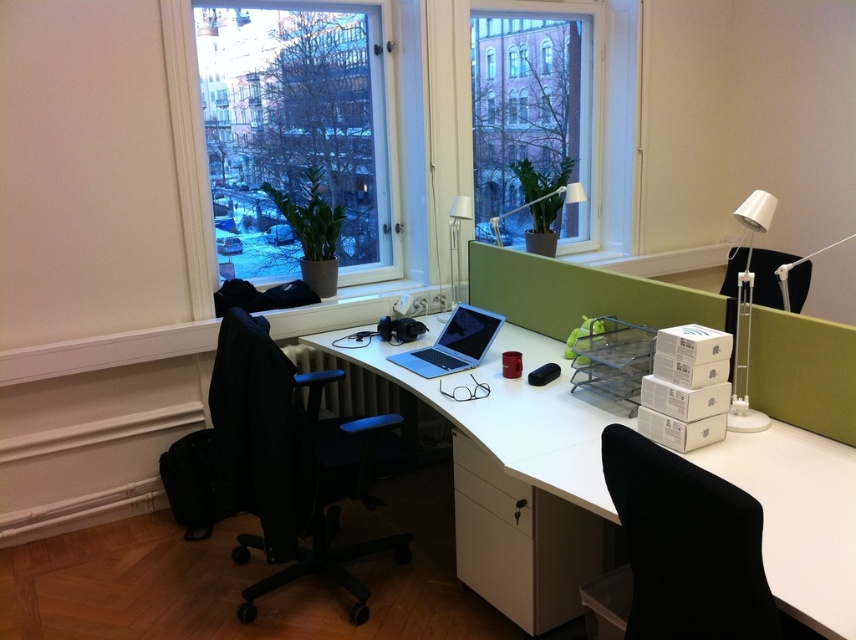
Question: Which object is closer to the camera taking this photo?

Choices:
 (A) white glossy computer desk at center
 (B) black fabric swivel chair at lower right
 (C) clear glass window at center

Answer: (B)

Question: Does clear glass window at upper left have a smaller size compared to black plastic swivel chair at left?

Choices:
 (A) no
 (B) yes

Answer: (A)

Question: Considering the real-world distances, which object is closest to the clear glass window at center?

Choices:
 (A) white glossy computer desk at center
 (B) black plastic swivel chair at left

Answer: (A)

Question: Is black plastic swivel chair at left thinner than clear glass window at center?

Choices:
 (A) yes
 (B) no

Answer: (B)

Question: Is black plastic swivel chair at left thinner than clear glass window at center?

Choices:
 (A) no
 (B) yes

Answer: (A)

Question: Which object is the closest to the sleek silver laptop at center?

Choices:
 (A) white glossy computer desk at center
 (B) white plastic lamp at upper right
 (C) transparent glass window at center

Answer: (A)